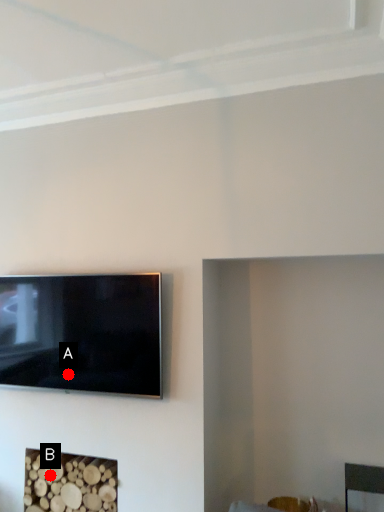
Question: Two points are circled on the image, labeled by A and B beside each circle. Which point is closer to the camera?

Choices:
 (A) A is closer
 (B) B is closer

Answer: (A)